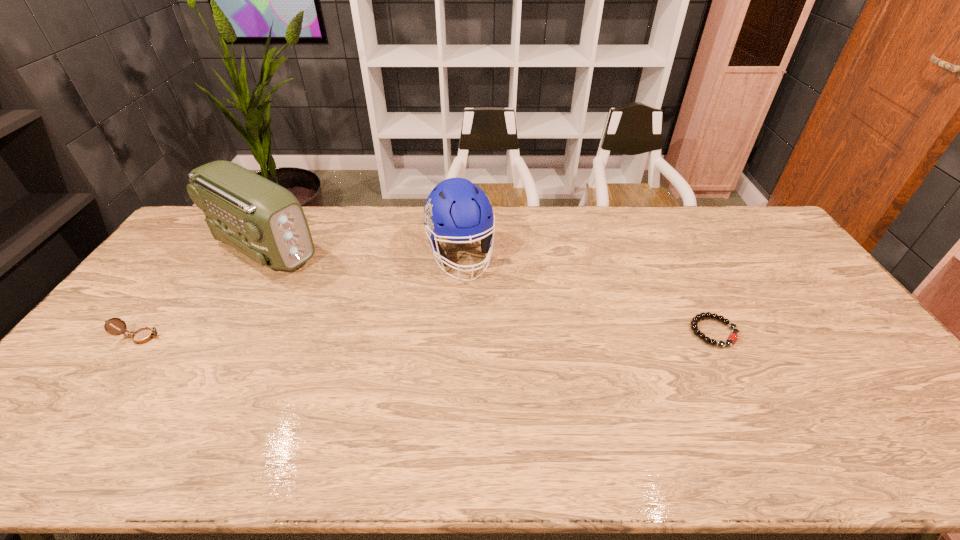
Image resolution: width=960 pixels, height=540 pixels. I want to click on vacant area that lies between the radio_receiver and the third tallest object, so click(203, 292).

At what (x,y) coordinates should I click in order to perform the action: click on free point between the third object from left to right and the rightmost object. Please return your answer as a coordinate pair (x, y). The width and height of the screenshot is (960, 540). Looking at the image, I should click on (587, 294).

Locate an element on the screen. The width and height of the screenshot is (960, 540). unoccupied position between the second object from right to left and the radio_receiver is located at coordinates (362, 252).

Locate which object ranks in proximity to the rightmost object. Please provide its 2D coordinates. Your answer should be formatted as a tuple, i.e. [(x, y)], where the tuple contains the x and y coordinates of a point satisfying the conditions above.

[(456, 209)]

Identify which object is located as the nearest to the football helmet. Please provide its 2D coordinates. Your answer should be formatted as a tuple, i.e. [(x, y)], where the tuple contains the x and y coordinates of a point satisfying the conditions above.

[(264, 221)]